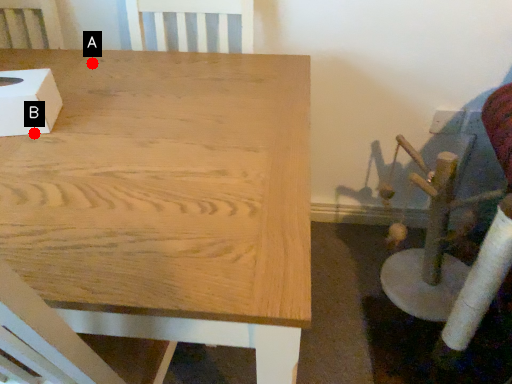
Question: Two points are circled on the image, labeled by A and B beside each circle. Which point appears closest to the camera in this image?

Choices:
 (A) A is closer
 (B) B is closer

Answer: (B)